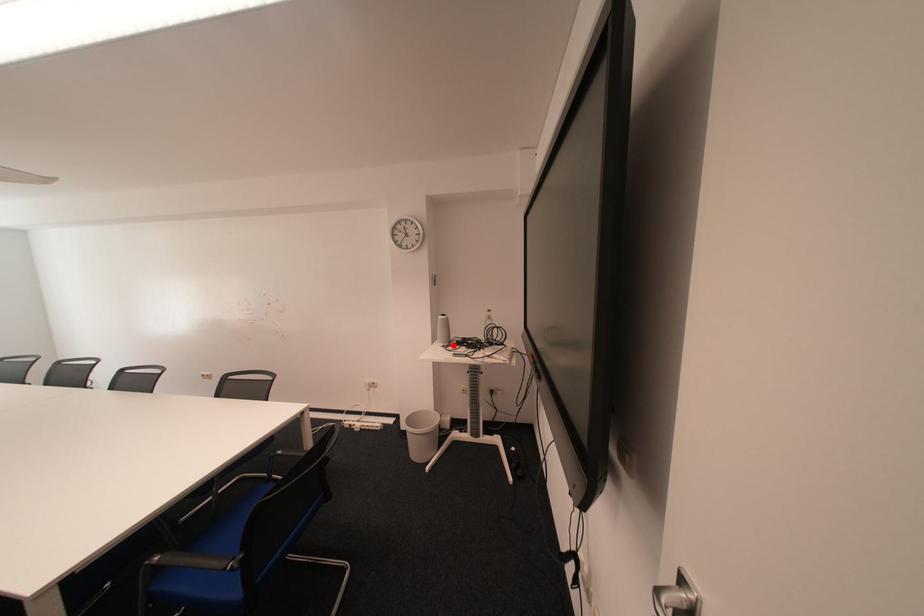
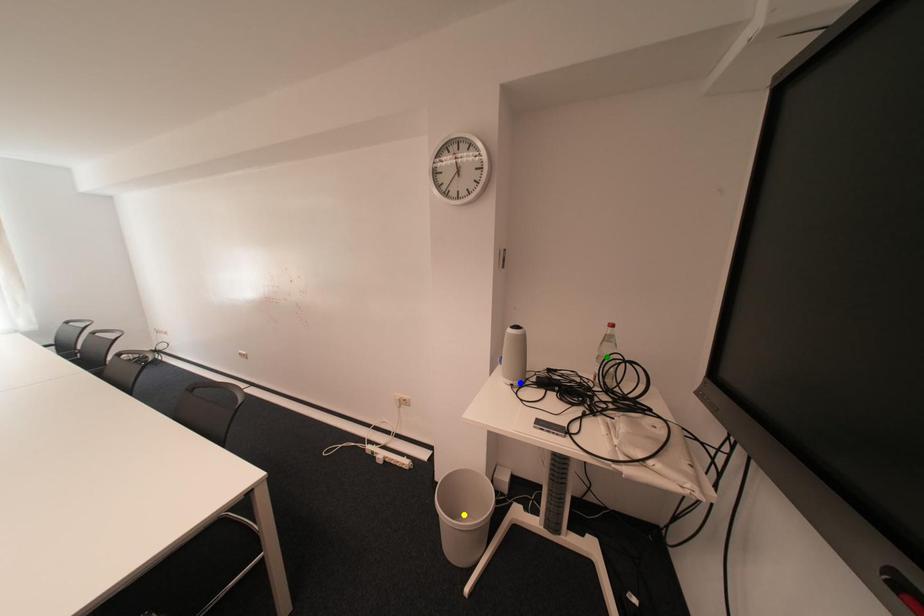
Question: I am providing you with two images of the same scene from different viewpoints. A red point is marked on the first image. You are given multiple points on the second image. Can you choose the point in image 2 that corresponds to the point in image 1?

Choices:
 (A) blue point
 (B) green point
 (C) yellow point

Answer: (A)